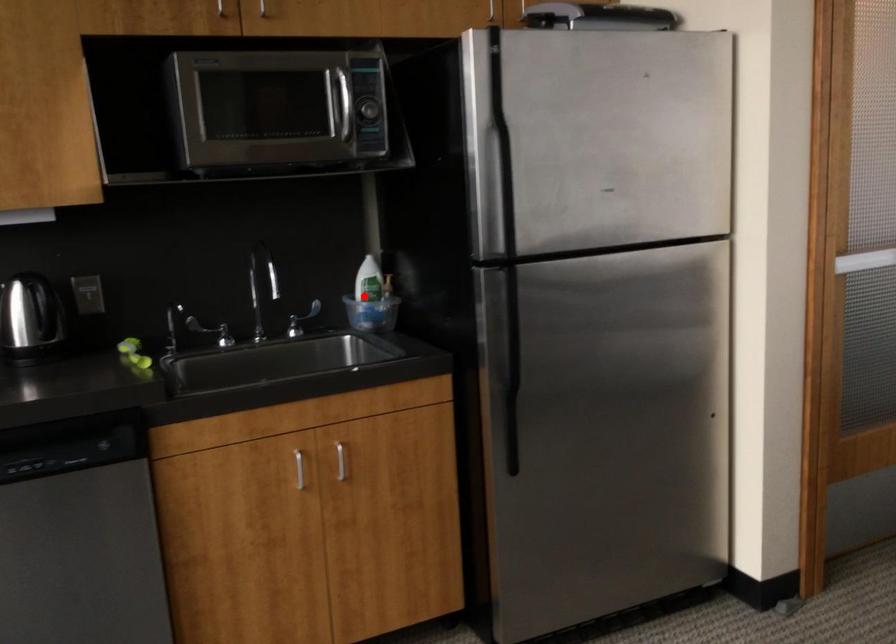
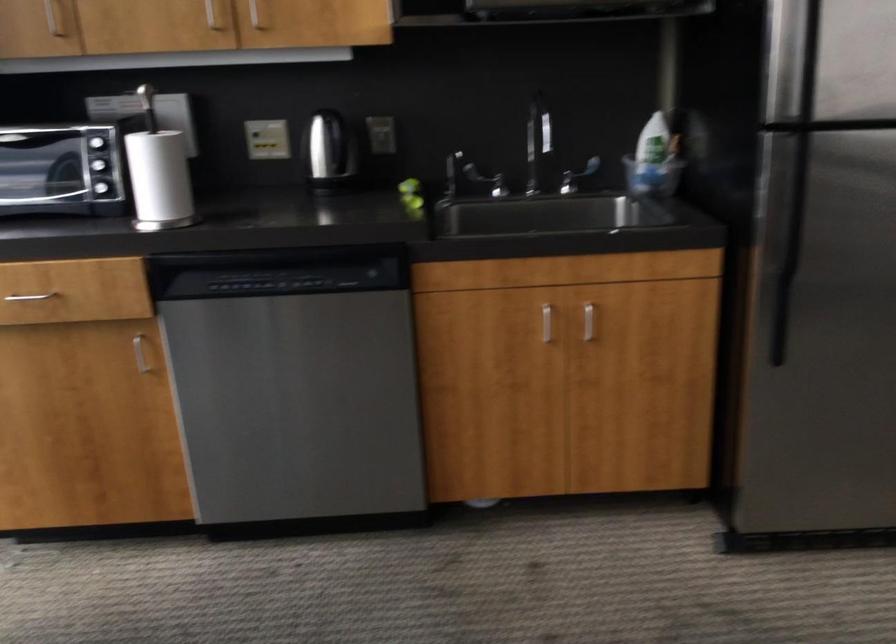
Locate, in the second image, the point that corresponds to the highlighted location in the first image.

(650, 155)